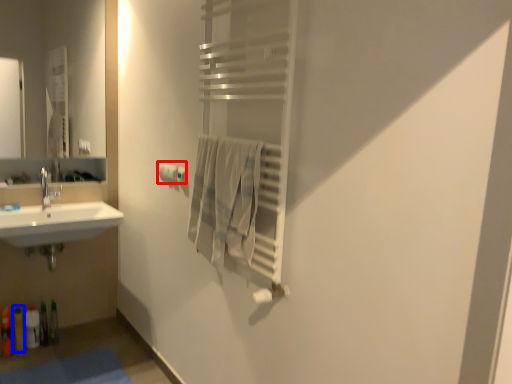
Question: Which object appears farthest to the camera in this image, toilet paper (highlighted by a red box) or toiletry (highlighted by a blue box)?

Choices:
 (A) toilet paper
 (B) toiletry

Answer: (B)